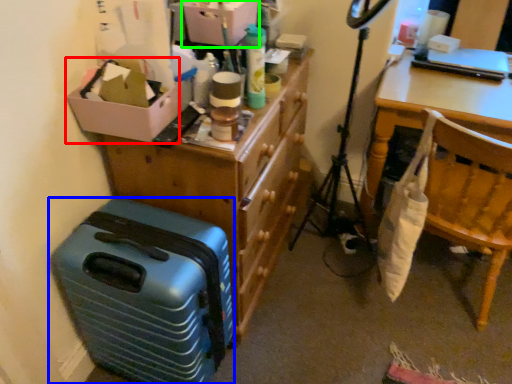
Question: Considering the real-world distances, which object is closest to box (highlighted by a red box)? suitcase (highlighted by a blue box) or storage box (highlighted by a green box).

Choices:
 (A) suitcase
 (B) storage box

Answer: (B)